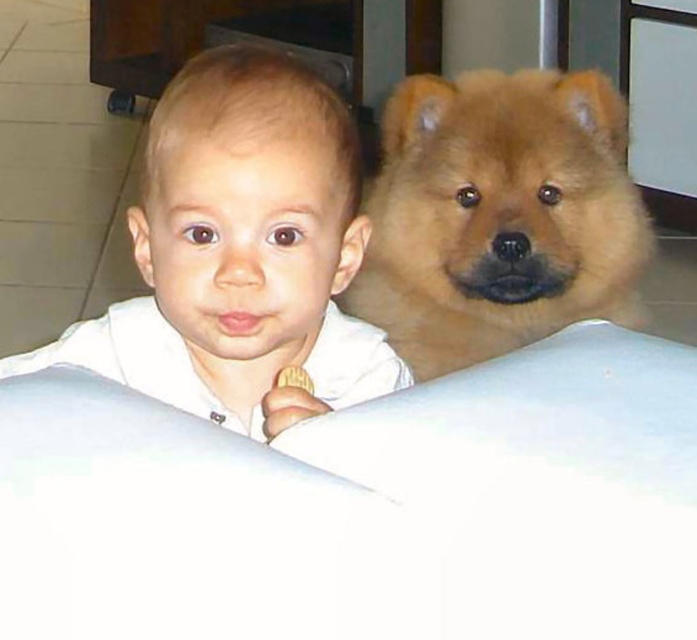
You are a photographer trying to capture a candid shot of the smooth white shirt at upper left and the fluffy brown dog at upper right. The camera has a minimum focus distance of 24 inches. Can you focus on both subjects simultaneously without moving the camera?

The distance between the smooth white shirt at upper left and the fluffy brown dog at upper right is 25.45 inches. Since the minimum focus distance is 24 inches, the camera can focus on both subjects simultaneously as the distance between them is greater than the minimum requirement.

You are standing in the room and see two points marked in the image. Which point is closer to you, point (286, 404) or point (625, 225)?

Point (286, 404) is in front of point (625, 225), so it is closer to you.